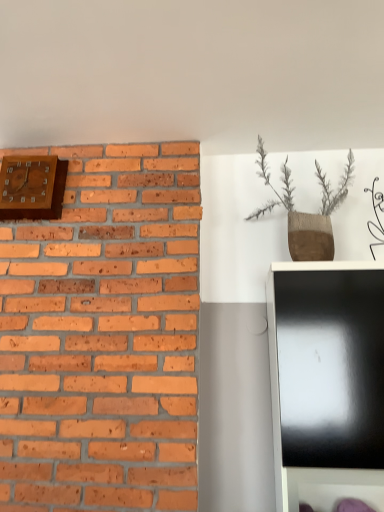
Question: Does textured brown vase at upper right have a lesser width compared to wooden clock at upper left?

Choices:
 (A) no
 (B) yes

Answer: (A)

Question: Is textured brown vase at upper right outside of wooden clock at upper left?

Choices:
 (A) no
 (B) yes

Answer: (B)

Question: Is textured brown vase at upper right turned away from wooden clock at upper left?

Choices:
 (A) yes
 (B) no

Answer: (B)

Question: Is textured brown vase at upper right at the left side of wooden clock at upper left?

Choices:
 (A) yes
 (B) no

Answer: (B)

Question: Considering the relative sizes of textured brown vase at upper right and wooden clock at upper left in the image provided, is textured brown vase at upper right wider than wooden clock at upper left?

Choices:
 (A) no
 (B) yes

Answer: (B)

Question: Does textured brown vase at upper right have a lesser height compared to wooden clock at upper left?

Choices:
 (A) no
 (B) yes

Answer: (A)

Question: Does wooden clock at upper left have a smaller size compared to textured brown vase at upper right?

Choices:
 (A) yes
 (B) no

Answer: (A)

Question: Does wooden clock at upper left come in front of textured brown vase at upper right?

Choices:
 (A) no
 (B) yes

Answer: (A)

Question: From a real-world perspective, is wooden clock at upper left physically above textured brown vase at upper right?

Choices:
 (A) yes
 (B) no

Answer: (A)

Question: Does wooden clock at upper left have a larger size compared to textured brown vase at upper right?

Choices:
 (A) no
 (B) yes

Answer: (A)

Question: Does wooden clock at upper left have a greater height compared to textured brown vase at upper right?

Choices:
 (A) no
 (B) yes

Answer: (A)

Question: Is wooden clock at upper left to the right of textured brown vase at upper right from the viewer's perspective?

Choices:
 (A) yes
 (B) no

Answer: (B)

Question: From the image's perspective, is wooden clock at upper left above or below textured brown vase at upper right?

Choices:
 (A) above
 (B) below

Answer: (A)